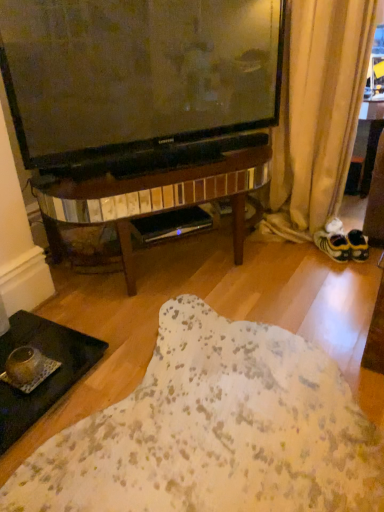
Question: From a real-world perspective, is yellow fabric shoe at right over beige fabric curtain at lower right?

Choices:
 (A) yes
 (B) no

Answer: (B)

Question: Would you say yellow fabric shoe at right is outside beige fabric curtain at lower right?

Choices:
 (A) no
 (B) yes

Answer: (A)

Question: Can you confirm if yellow fabric shoe at right is shorter than beige fabric curtain at lower right?

Choices:
 (A) no
 (B) yes

Answer: (B)

Question: Is yellow fabric shoe at right touching beige fabric curtain at lower right?

Choices:
 (A) yes
 (B) no

Answer: (B)

Question: Considering the relative sizes of yellow fabric shoe at right and beige fabric curtain at lower right in the image provided, is yellow fabric shoe at right thinner than beige fabric curtain at lower right?

Choices:
 (A) yes
 (B) no

Answer: (A)

Question: From the image's perspective, does yellow fabric shoe at right appear higher than beige fabric curtain at lower right?

Choices:
 (A) no
 (B) yes

Answer: (A)

Question: Does beige fabric curtain at lower right touch black glass tray at lower left?

Choices:
 (A) yes
 (B) no

Answer: (B)

Question: From a real-world perspective, is beige fabric curtain at lower right over black glass tray at lower left?

Choices:
 (A) no
 (B) yes

Answer: (B)

Question: Is beige fabric curtain at lower right closer to the viewer compared to black glass tray at lower left?

Choices:
 (A) no
 (B) yes

Answer: (A)

Question: Can we say beige fabric curtain at lower right lies outside black glass tray at lower left?

Choices:
 (A) no
 (B) yes

Answer: (B)

Question: From the image's perspective, is beige fabric curtain at lower right on top of black glass tray at lower left?

Choices:
 (A) yes
 (B) no

Answer: (A)

Question: Can you confirm if beige fabric curtain at lower right is bigger than black glass tray at lower left?

Choices:
 (A) no
 (B) yes

Answer: (B)

Question: Is beige fabric curtain at lower right positioned before yellow fabric shoe at right?

Choices:
 (A) yes
 (B) no

Answer: (A)